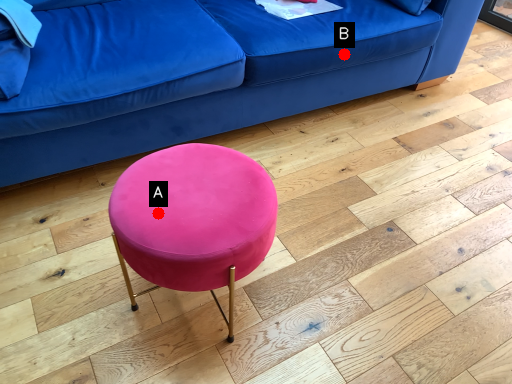
Question: Two points are circled on the image, labeled by A and B beside each circle. Which point is closer to the camera taking this photo?

Choices:
 (A) A is closer
 (B) B is closer

Answer: (A)